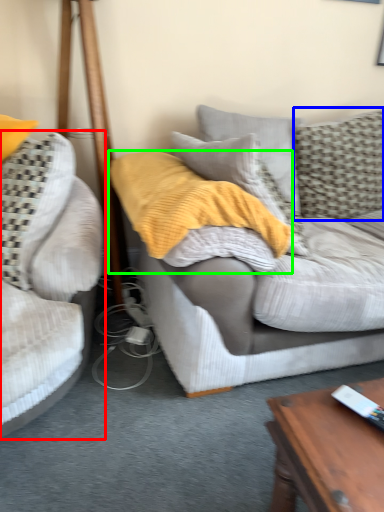
Question: Considering the real-world distances, which object is farthest from studio couch (highlighted by a red box)? pillow (highlighted by a blue box) or blanket (highlighted by a green box)?

Choices:
 (A) pillow
 (B) blanket

Answer: (A)